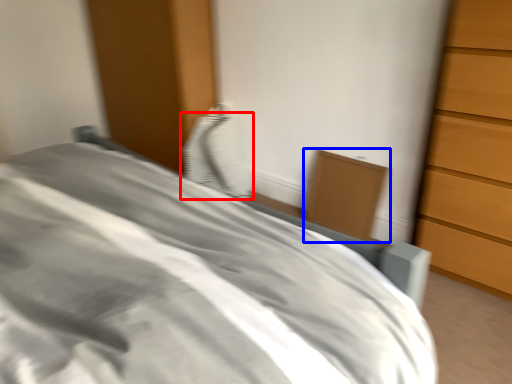
Question: Which point is closer to the camera, pillow (highlighted by a red box) or cabinetry (highlighted by a blue box)?

Choices:
 (A) pillow
 (B) cabinetry

Answer: (B)